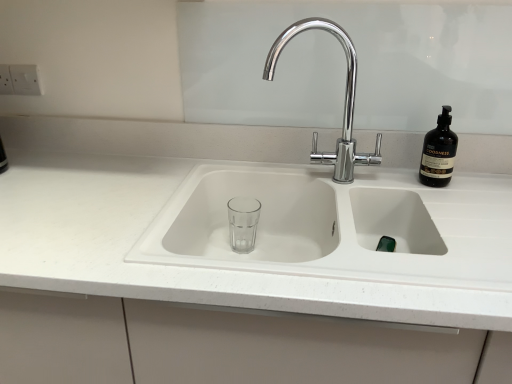
Question: Can we say white matte countertop at center lies outside chrome/metallic faucet at center?

Choices:
 (A) no
 (B) yes

Answer: (B)

Question: Can you confirm if white matte countertop at center is bigger than chrome/metallic faucet at center?

Choices:
 (A) yes
 (B) no

Answer: (A)

Question: Is white matte countertop at center to the left of chrome/metallic faucet at center from the viewer's perspective?

Choices:
 (A) yes
 (B) no

Answer: (A)

Question: Is the surface of white matte countertop at center in direct contact with chrome/metallic faucet at center?

Choices:
 (A) yes
 (B) no

Answer: (B)

Question: Does white matte countertop at center turn towards chrome/metallic faucet at center?

Choices:
 (A) yes
 (B) no

Answer: (B)

Question: Considering the positions of dark brown glass bottle at upper right and white matte countertop at center in the image, is dark brown glass bottle at upper right wider or thinner than white matte countertop at center?

Choices:
 (A) thin
 (B) wide

Answer: (A)

Question: From the image's perspective, is dark brown glass bottle at upper right located above or below white matte countertop at center?

Choices:
 (A) above
 (B) below

Answer: (A)

Question: Is dark brown glass bottle at upper right bigger or smaller than white matte countertop at center?

Choices:
 (A) small
 (B) big

Answer: (A)

Question: Is point (442, 119) closer or farther from the camera than point (146, 195)?

Choices:
 (A) closer
 (B) farther

Answer: (B)

Question: From the image's perspective, is white matte countertop at center above or below chrome/metallic faucet at center?

Choices:
 (A) below
 (B) above

Answer: (A)

Question: Is white matte countertop at center in front of or behind chrome/metallic faucet at center in the image?

Choices:
 (A) front
 (B) behind

Answer: (A)

Question: Is white matte countertop at center bigger or smaller than chrome/metallic faucet at center?

Choices:
 (A) small
 (B) big

Answer: (B)

Question: Is white matte countertop at center to the left or to the right of chrome/metallic faucet at center in the image?

Choices:
 (A) right
 (B) left

Answer: (B)

Question: Visually, is chrome/metallic faucet at center positioned to the left or to the right of dark brown glass bottle at upper right?

Choices:
 (A) right
 (B) left

Answer: (B)

Question: Is chrome/metallic faucet at center in front of or behind dark brown glass bottle at upper right in the image?

Choices:
 (A) behind
 (B) front

Answer: (B)